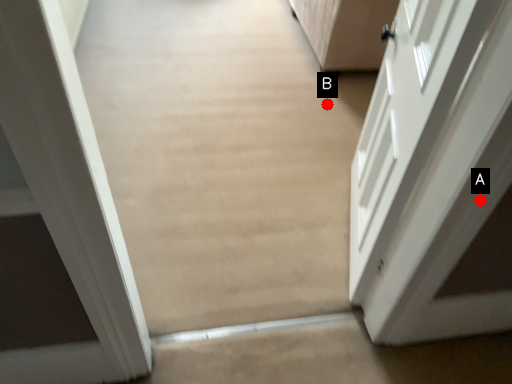
Question: Two points are circled on the image, labeled by A and B beside each circle. Among these points, which one is nearest to the camera?

Choices:
 (A) A is closer
 (B) B is closer

Answer: (A)